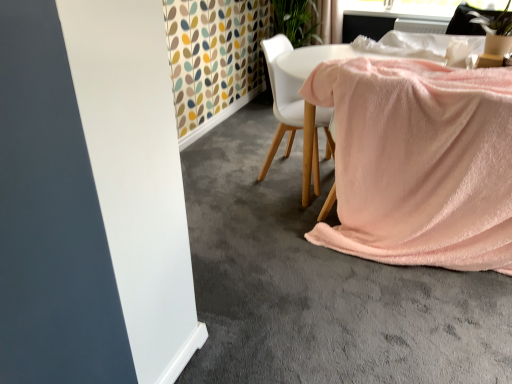
Question: Is point (268, 77) closer or farther from the camera than point (496, 26)?

Choices:
 (A) closer
 (B) farther

Answer: (B)

Question: Is white fabric chair at center to the left or to the right of green leafy plant at upper right in the image?

Choices:
 (A) left
 (B) right

Answer: (A)

Question: Estimate the real-world distances between objects in this image. Which object is farther from the pink soft blanket at lower right?

Choices:
 (A) green leafy plant at upper right
 (B) pink soft fabric at center
 (C) white fabric chair at center

Answer: (A)

Question: Estimate the real-world distances between objects in this image. Which object is farther from the pink soft fabric at center?

Choices:
 (A) green leafy plant at upper right
 (B) white fabric chair at center
 (C) pink soft blanket at lower right

Answer: (A)